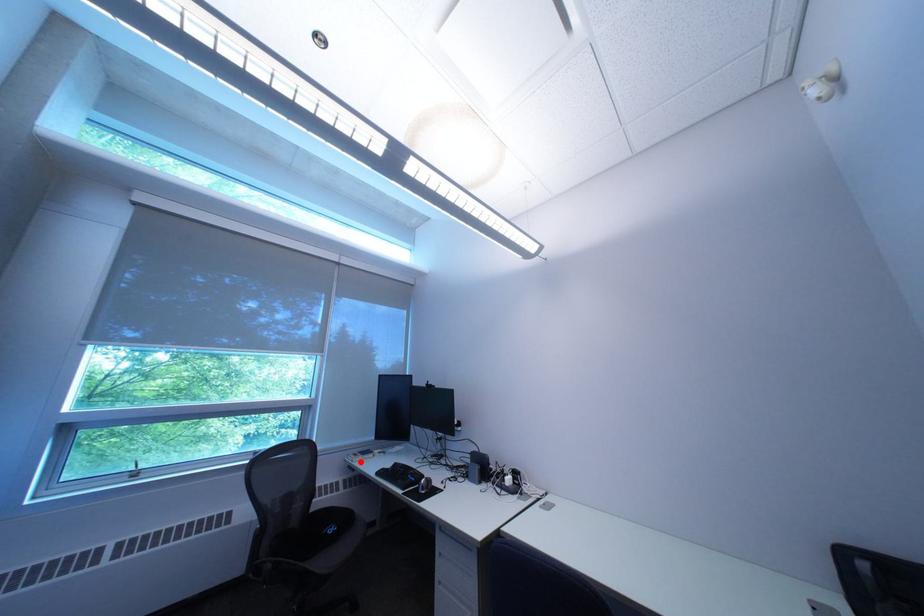
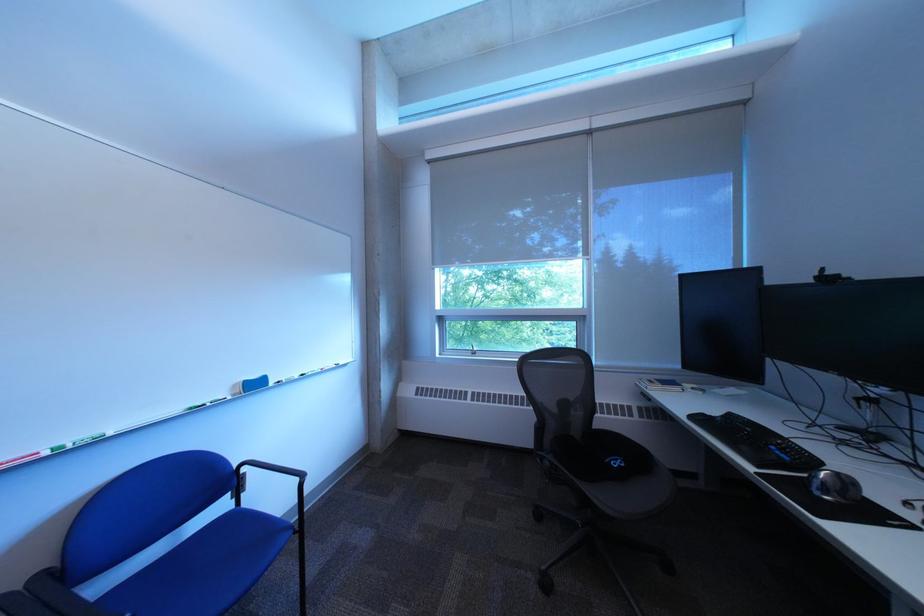
Question: I am providing you with two images of the same scene from different viewpoints. A red point is shown in image1. For the corresponding object point in image2, is it positioned nearer or farther from the camera?

Choices:
 (A) Nearer
 (B) Farther

Answer: (B)